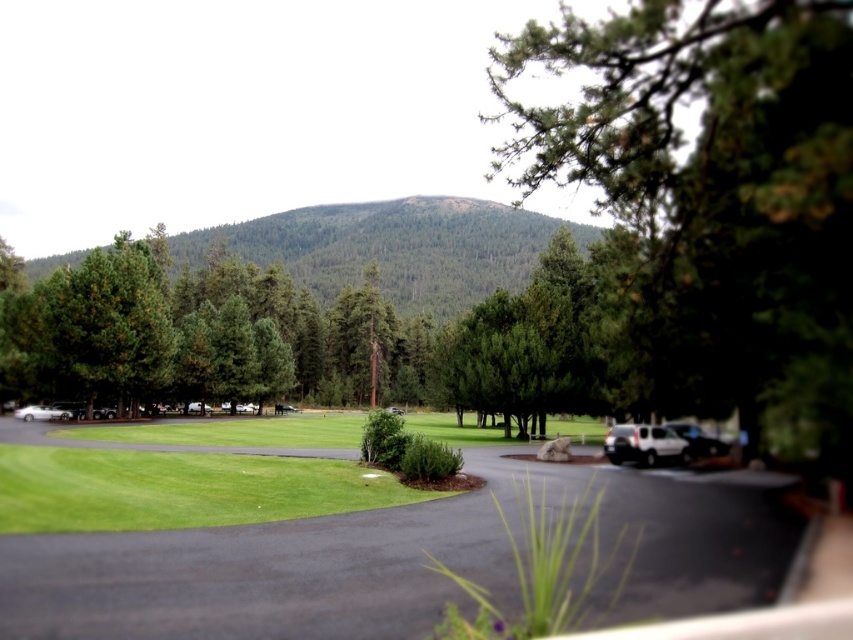
Does green textured tree at upper right lie in front of metallic silver car at left?

Yes.

Is point (758, 211) more distant than point (39, 413)?

No, (758, 211) is in front of (39, 413).

You are a GUI agent. You are given a task and a screenshot of the screen. Output one action in this format:
    pyautogui.click(x=<x>, y=<y>)
    Task: Click on the green textured tree at upper right
    The width and height of the screenshot is (853, 640).
    Given the screenshot: What is the action you would take?
    pyautogui.click(x=715, y=198)

Does green forested mountain at center appear over metallic silver car at left?

Yes.

Can you confirm if green forested mountain at center is smaller than metallic silver car at left?

No.

This screenshot has height=640, width=853. In order to click on green forested mountain at center in this screenshot , I will do `click(393, 248)`.

Is point (640, 433) positioned after point (35, 417)?

No, (640, 433) is in front of (35, 417).

Can you confirm if white matte suv at lower right is positioned to the right of metallic silver car at left?

Correct, you'll find white matte suv at lower right to the right of metallic silver car at left.

Does point (657, 436) lie behind point (33, 419)?

No.

Find the location of a particular element. This screenshot has width=853, height=640. white matte suv at lower right is located at coordinates (643, 444).